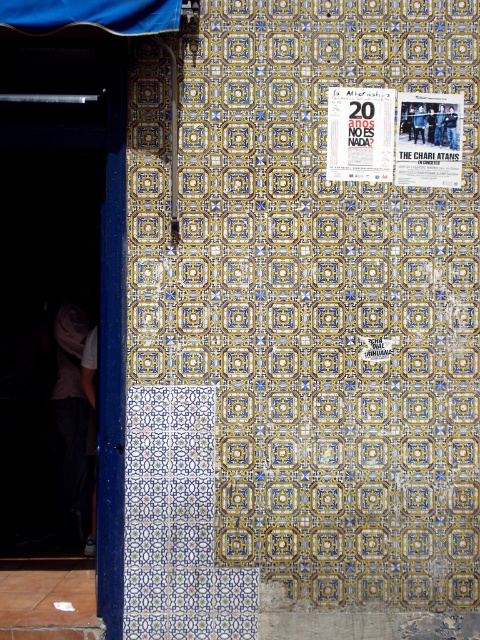
You are standing in front of the wall with tiles. There is a point marked at coordinate (112, 346). What is located at that point?

The point at coordinate (112, 346) is located at the blue painted wood at left.

You are an art student who wants to hang a new poster between the white paper poster at upper center and the matte paper poster at upper right. Considering their sizes, which poster should you place closer to the center of the wall to maintain balance?

The white paper poster at upper center is larger in size than the matte paper poster at upper right. To maintain balance, you should place the smaller matte paper poster at upper right closer to the center of the wall so that its smaller size doesn